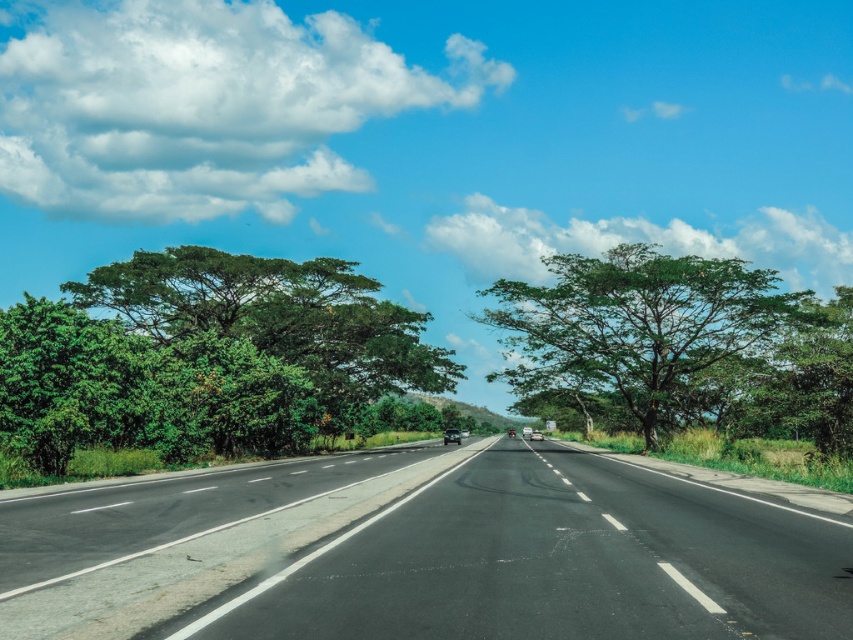
Is point (543, 620) in front of point (674, 300)?

Yes, point (543, 620) is closer to viewer.

Which is more to the left, black asphalt highway at center or green leafy tree at center?

black asphalt highway at center is more to the left.

Between point (148, 584) and point (757, 324), which one is positioned behind?

Positioned behind is point (757, 324).

The image size is (853, 640). I want to click on black asphalt highway at center, so click(424, 552).

Who is shorter, green leafy tree at left or green leafy tree at center?

With less height is green leafy tree at left.

This screenshot has width=853, height=640. What do you see at coordinates (206, 356) in the screenshot? I see `green leafy tree at left` at bounding box center [206, 356].

Where is `green leafy tree at left`? green leafy tree at left is located at coordinates (206, 356).

Can you confirm if black asphalt highway at center is wider than green leafy tree at left?

Incorrect, black asphalt highway at center's width does not surpass green leafy tree at left's.

Based on the photo, does black asphalt highway at center appear on the right side of green leafy tree at left?

Yes, black asphalt highway at center is to the right of green leafy tree at left.

This screenshot has width=853, height=640. In order to click on black asphalt highway at center in this screenshot , I will do `click(424, 552)`.